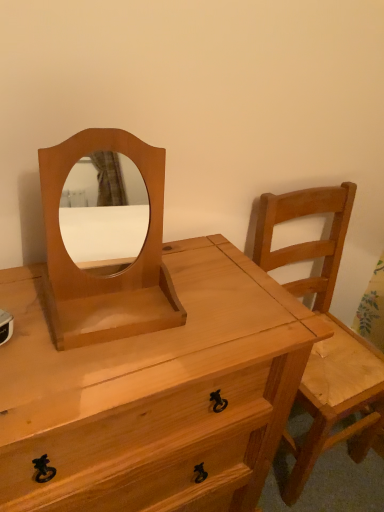
Find the location of `vacant area located to the right-hand side of light brown wood mirror at center`. vacant area located to the right-hand side of light brown wood mirror at center is located at coordinates (205, 325).